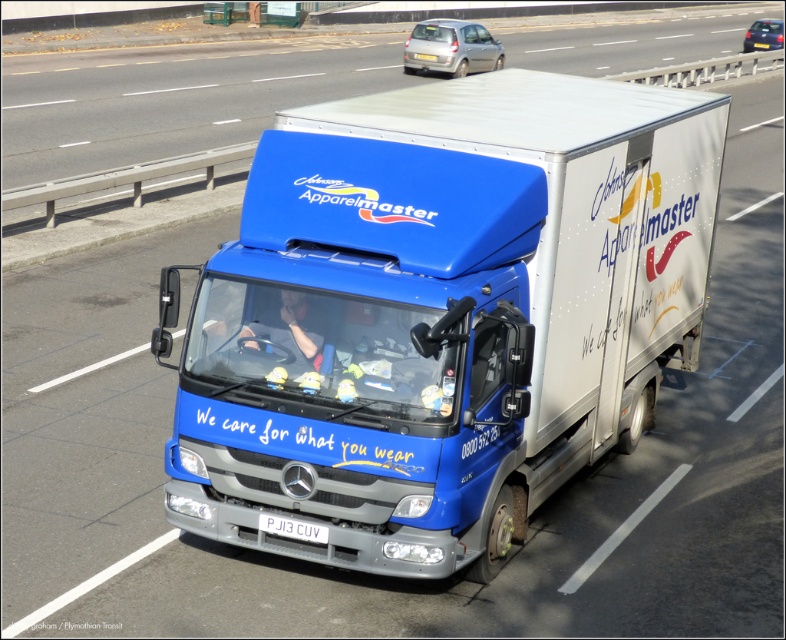
Question: Which object is farther from the camera taking this photo?

Choices:
 (A) white plastic license plate at center
 (B) blue metallic truck at center

Answer: (A)

Question: From the image, what is the correct spatial relationship of blue metallic truck at center in relation to white plastic license plate at center?

Choices:
 (A) above
 (B) below

Answer: (A)

Question: Is blue metallic truck at center below white plastic license plate at center?

Choices:
 (A) no
 (B) yes

Answer: (A)

Question: Which point is farther to the camera?

Choices:
 (A) (474, 376)
 (B) (263, 520)

Answer: (B)

Question: Can you confirm if blue metallic truck at center is positioned to the left of white plastic license plate at center?

Choices:
 (A) yes
 (B) no

Answer: (B)

Question: Which object appears farthest from the camera in this image?

Choices:
 (A) white plastic license plate at center
 (B) blue metallic truck at center

Answer: (A)